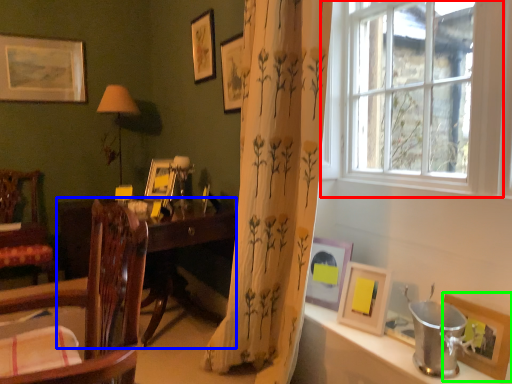
Question: Which is nearer to the window (highlighted by a red box)? desk (highlighted by a blue box) or picture frame (highlighted by a green box).

Choices:
 (A) desk
 (B) picture frame

Answer: (B)